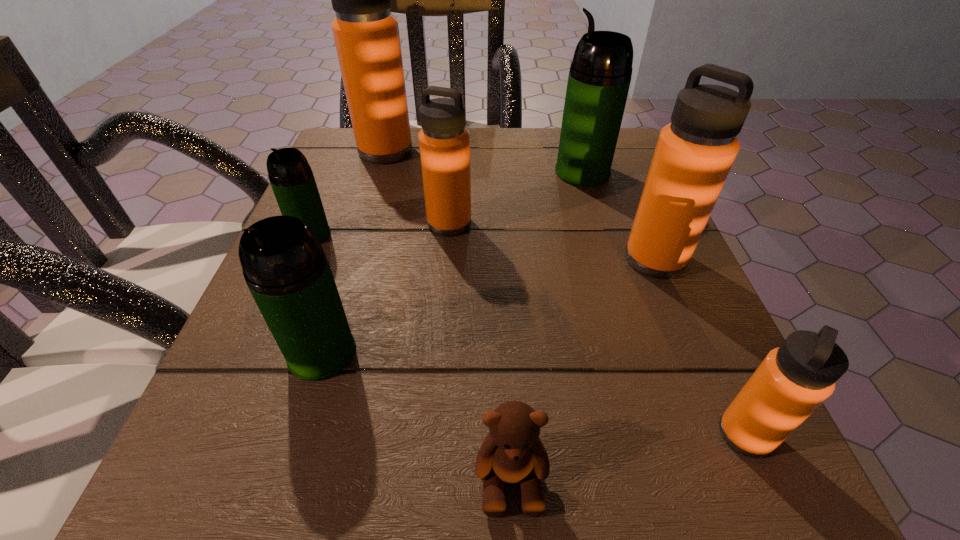
Where is `vacant space positioned from the spout of the sixth farthest thermos bottle`? The width and height of the screenshot is (960, 540). vacant space positioned from the spout of the sixth farthest thermos bottle is located at coordinates (297, 435).

Locate an element on the screen. The height and width of the screenshot is (540, 960). free space located 0.370m on the front of the second smallest orange thermos bottle is located at coordinates (432, 448).

Find the location of `vacant space located 0.150m from the spout of the leftmost green thermos bottle`. vacant space located 0.150m from the spout of the leftmost green thermos bottle is located at coordinates (276, 316).

Locate an element on the screen. This screenshot has height=540, width=960. free space located on the back of the smallest orange thermos bottle is located at coordinates (671, 267).

The height and width of the screenshot is (540, 960). What are the coordinates of `thermos bottle that is at the near edge` in the screenshot? It's located at (793, 380).

The width and height of the screenshot is (960, 540). Identify the location of teddy bear at the near edge. (512, 452).

Identify the location of object located in the far left corner section of the desktop. The width and height of the screenshot is (960, 540). (x=366, y=34).

Image resolution: width=960 pixels, height=540 pixels. Identify the location of object positioned at the far right corner. (600, 74).

Identify the location of object that is at the near right corner. (793, 380).

Where is `free region at the far edge of the desktop`? The width and height of the screenshot is (960, 540). free region at the far edge of the desktop is located at coordinates (491, 158).